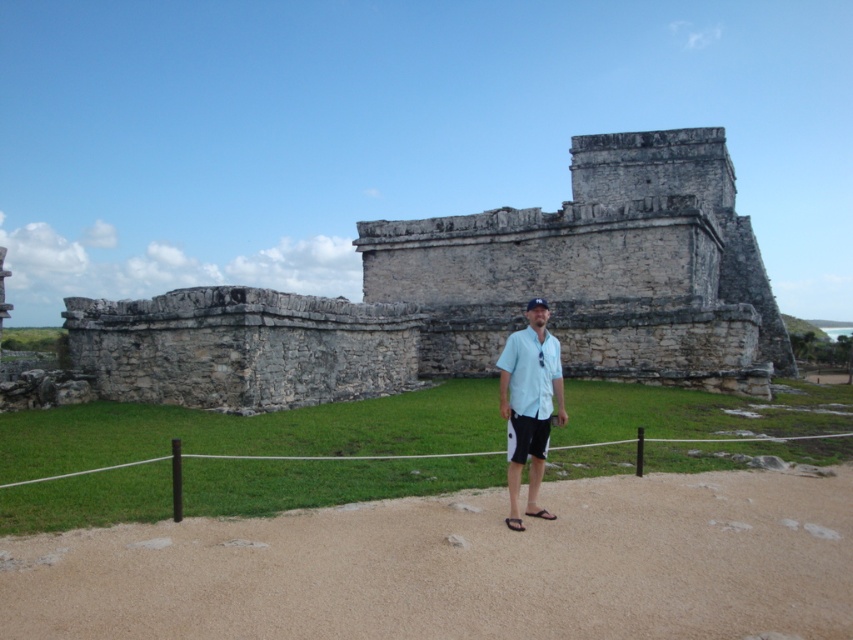
You are a photographer trying to capture the person in the image. The light blue fabric shirt at center and the light blue cotton polo shirt at center are both visible. Which shirt should you focus on to ensure it covers more of the ancient stone ruins in the background?

The light blue fabric shirt at center has a larger width than the light blue cotton polo shirt at center, so focusing on it will cover more of the ancient stone ruins in the background.

You are a photographer planning to capture a wide shot of the gray stone castle at center and the light blue cotton polo shirt at center in the image. Considering their sizes, which object should you focus on first to ensure both are in frame?

The gray stone castle at center is bigger than the light blue cotton polo shirt at center, so you should focus on the gray stone castle at center first to ensure both are in frame.

You are a photographer trying to capture the gray stone castle at center and the light blue cotton polo shirt at center in your shot. Which object should you focus on first if you want to ensure both are in sharp focus?

The gray stone castle at center is positioned over the light blue cotton polo shirt at center, so focusing on the gray stone castle at center first will help ensure both are in sharp focus since it is closer to the camera.